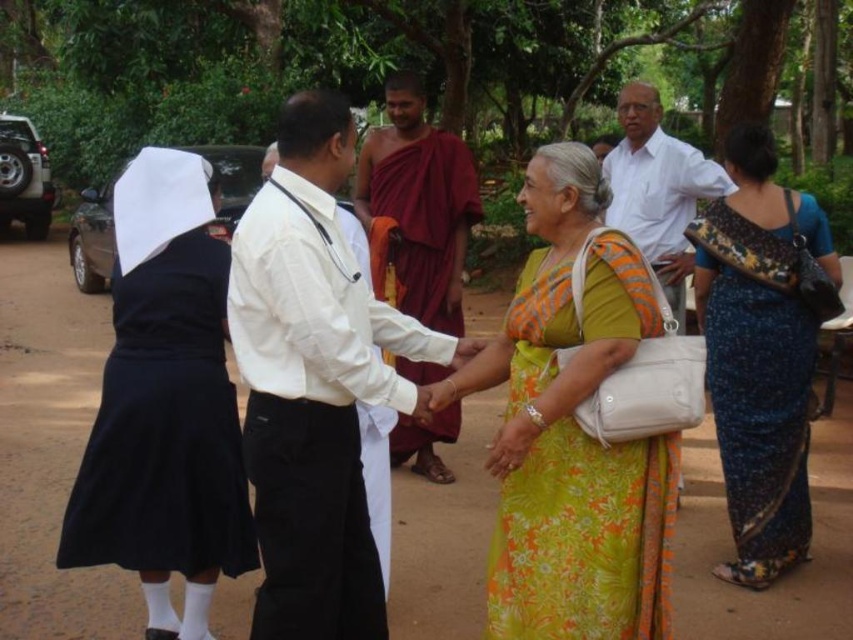
You are organizing a photo shoot and need to arrange two outfits for a photoshoot setup. The first outfit is the black fabric dress at left and the second is the maroon clothed monk at center. Based on their widths, which outfit should be placed on a wider mannequin?

The maroon clothed monk at center should be placed on a wider mannequin since the black fabric dress at left is narrower than the maroon clothed monk at center according to the description.

You are a photographer trying to capture a group photo of the people in the scene. You want to ensure that both the black fabric dress at left and the blue floral saree at lower right are clearly visible in the frame. Based on their positions, which one should you focus on first to ensure they are both in the shot?

The black fabric dress at left is positioned on the left side of the blue floral saree at lower right, so focusing on the blue floral saree at lower right first would help ensure both are within the frame since the black fabric dress at left is to its left side.